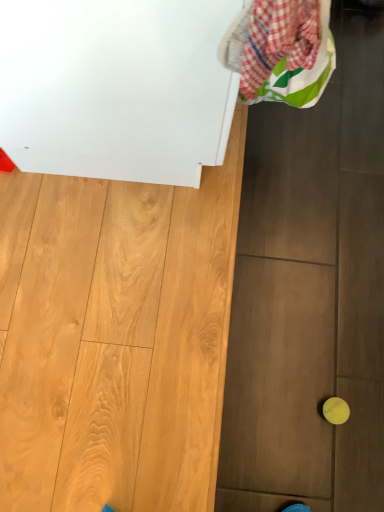
Where is `vacant space behind yellow rubber ball at lower right`? vacant space behind yellow rubber ball at lower right is located at coordinates (339, 348).